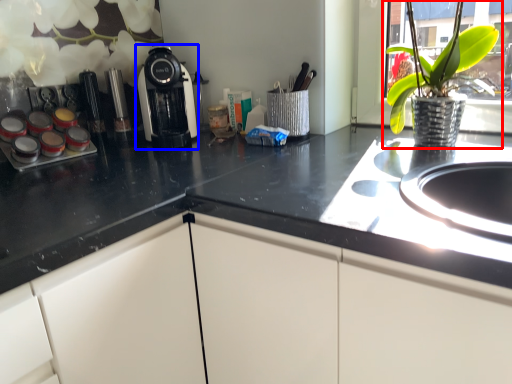
Question: Which object appears farthest to the camera in this image, houseplant (highlighted by a red box) or kitchen appliance (highlighted by a blue box)?

Choices:
 (A) houseplant
 (B) kitchen appliance

Answer: (B)